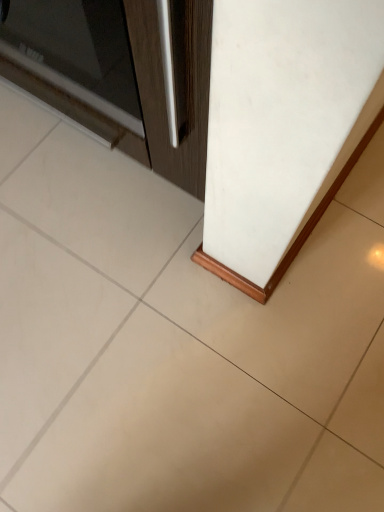
Find the location of a particular element. The image size is (384, 512). dark brown wood screen door at upper left is located at coordinates (79, 63).

Image resolution: width=384 pixels, height=512 pixels. Describe the element at coordinates (79, 63) in the screenshot. I see `dark brown wood screen door at upper left` at that location.

Measure the distance between point (x=32, y=14) and camera.

They are 32.48 inches apart.

Identify the location of dark brown wood screen door at upper left. (79, 63).